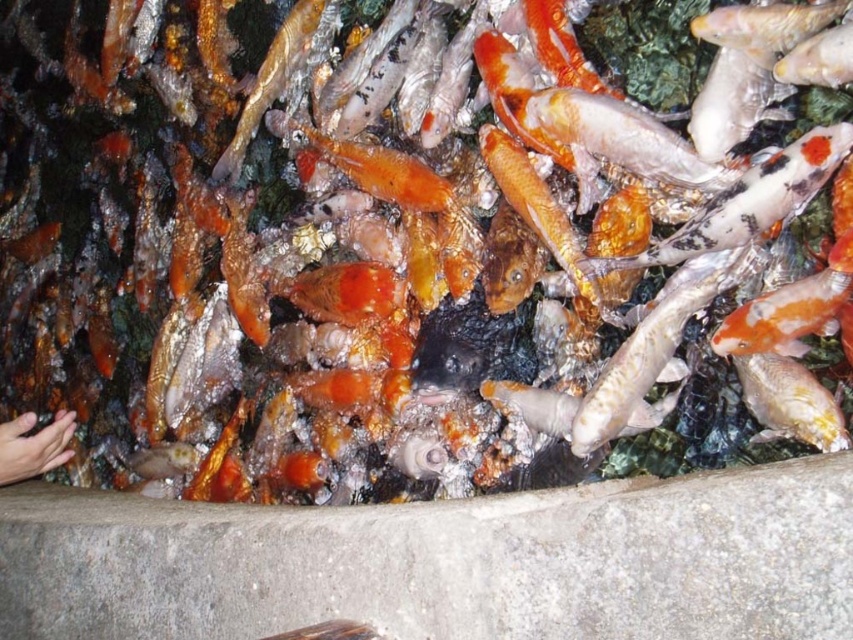
Is shiny silver fish at center to the right of shiny gold fish at upper left from the viewer's perspective?

Yes, shiny silver fish at center is to the right of shiny gold fish at upper left.

Does shiny silver fish at center have a lesser width compared to shiny gold fish at upper left?

Correct, shiny silver fish at center's width is less than shiny gold fish at upper left's.

This screenshot has width=853, height=640. Describe the element at coordinates (790, 403) in the screenshot. I see `shiny silver fish at center` at that location.

Locate an element on the screen. The width and height of the screenshot is (853, 640). shiny silver fish at center is located at coordinates (790, 403).

Is point (305, 17) behind point (53, 467)?

No, it is in front of (53, 467).

Is shiny gold fish at upper left positioned before smooth skin hand at lower left?

No, shiny gold fish at upper left is behind smooth skin hand at lower left.

Find the location of `shiny gold fish at upper left`. shiny gold fish at upper left is located at coordinates (270, 81).

Between shiny silver fish at center and smooth skin hand at lower left, which one is positioned lower?

smooth skin hand at lower left

Is shiny silver fish at center further to camera compared to smooth skin hand at lower left?

No, it is in front of smooth skin hand at lower left.

The width and height of the screenshot is (853, 640). Describe the element at coordinates (790, 403) in the screenshot. I see `shiny silver fish at center` at that location.

Find the location of a particular element. Image resolution: width=853 pixels, height=640 pixels. shiny silver fish at center is located at coordinates (790, 403).